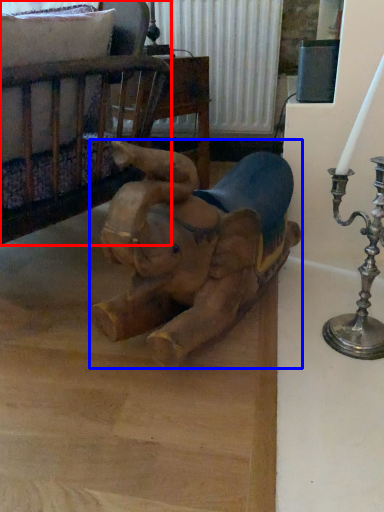
Question: Which point is closer to the camera, furniture (highlighted by a red box) or toy (highlighted by a blue box)?

Choices:
 (A) furniture
 (B) toy

Answer: (B)